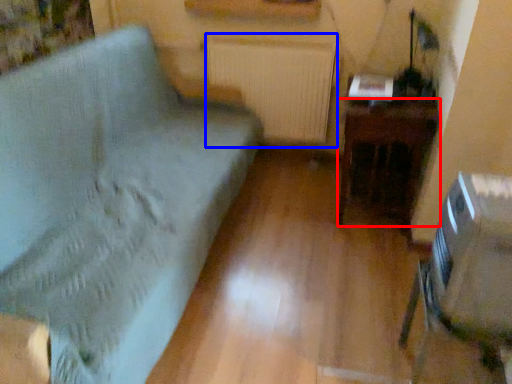
Question: Among these objects, which one is farthest to the camera, table (highlighted by a red box) or radiator (highlighted by a blue box)?

Choices:
 (A) table
 (B) radiator

Answer: (B)